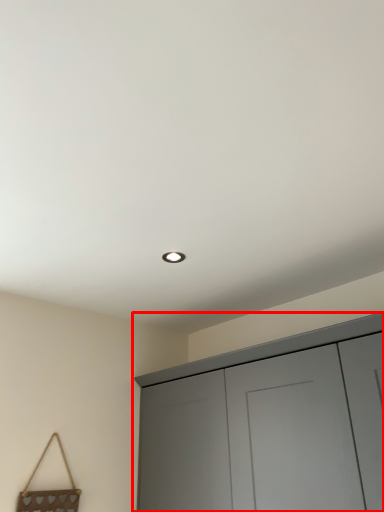
Question: From the image's perspective, where is cupboard (annotated by the red box) located relative to handbag?

Choices:
 (A) above
 (B) below

Answer: (A)